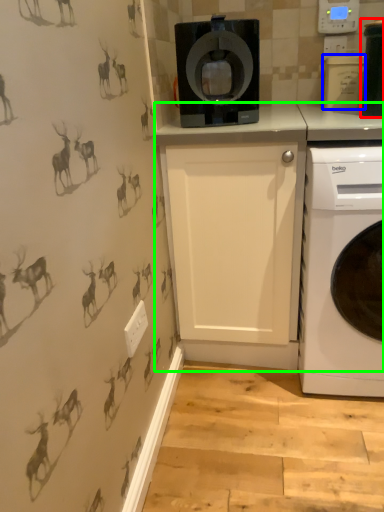
Question: Which object is positioned closest to appliance (highlighted by a red box)? Select from appliance (highlighted by a blue box) and counter (highlighted by a green box).

Choices:
 (A) appliance
 (B) counter

Answer: (A)